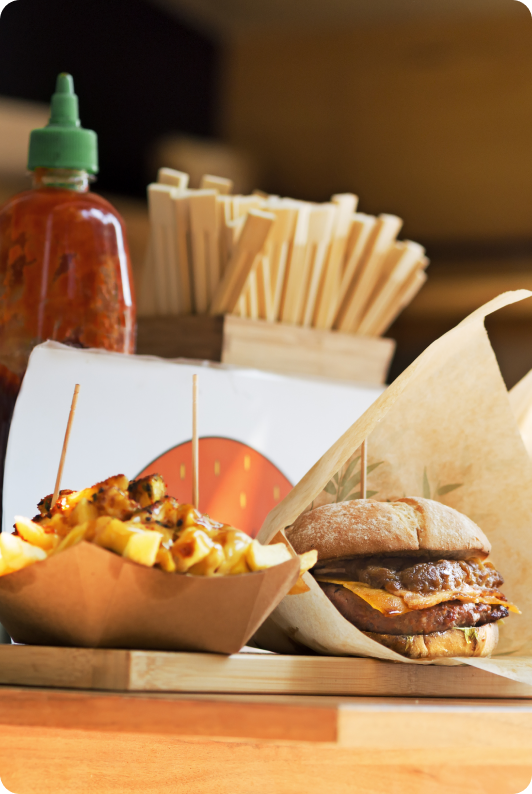
Where is `table`? Image resolution: width=532 pixels, height=794 pixels. table is located at coordinates (376, 727), (210, 768).